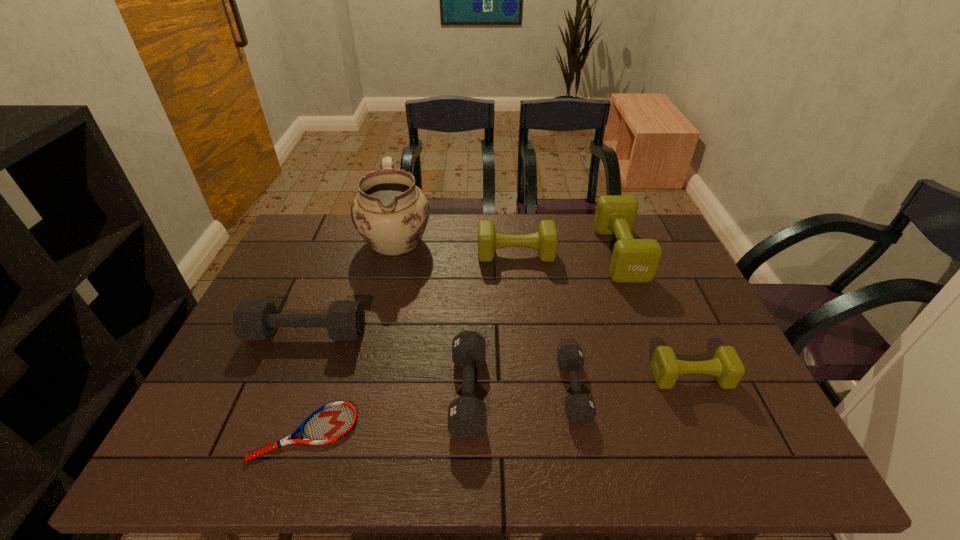
The width and height of the screenshot is (960, 540). I want to click on vacant space at the right edge of the desktop, so click(742, 401).

In the image, there is a desktop. At what (x,y) coordinates should I click in order to perform the action: click on vacant space at the far left corner. Please return your answer as a coordinate pair (x, y). Image resolution: width=960 pixels, height=540 pixels. Looking at the image, I should click on (310, 238).

In the image, there is a desktop. Find the location of `vacant space at the near right corner`. vacant space at the near right corner is located at coordinates (779, 457).

Identify the location of free space between the pitcher and the second biggest gray dumbbell. This screenshot has height=540, width=960. 432,316.

This screenshot has height=540, width=960. What are the coordinates of `free space between the biggest olive dumbbell and the leftmost olive dumbbell` in the screenshot? It's located at (568, 254).

Find the location of `free space between the fifth nearest object and the smallest olive dumbbell`. free space between the fifth nearest object and the smallest olive dumbbell is located at coordinates (498, 355).

This screenshot has height=540, width=960. Identify the location of empty location between the farthest gray dumbbell and the shortest dumbbell. (440, 362).

At what (x,y) coordinates should I click in order to perform the action: click on blank region between the tennis racket and the second gray dumbbell from right to left. Please return your answer as a coordinate pair (x, y). The image size is (960, 540). Looking at the image, I should click on (387, 412).

The height and width of the screenshot is (540, 960). I want to click on free space between the second smallest olive dumbbell and the smallest gray dumbbell, so click(x=544, y=322).

The image size is (960, 540). In order to click on vacant area between the leftmost dumbbell and the second gray dumbbell from left to right in this screenshot , I will do `click(387, 363)`.